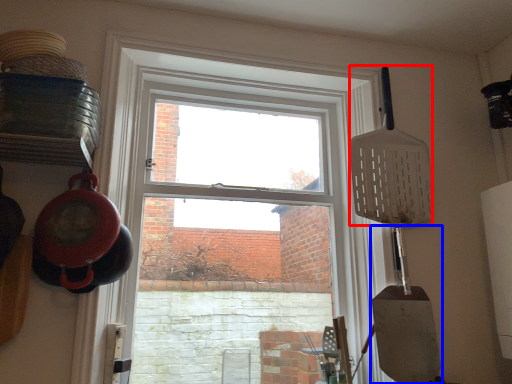
Question: Which point is further to the camera, spatula (highlighted by a red box) or shovel (highlighted by a blue box)?

Choices:
 (A) spatula
 (B) shovel

Answer: (A)